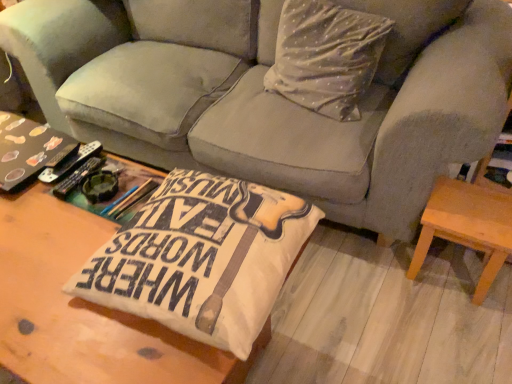
This screenshot has height=384, width=512. Find the location of `free point above light brown wooden stool at lower right, which appears as the first table when viewed from the back (from a real-world perspective)`. free point above light brown wooden stool at lower right, which appears as the first table when viewed from the back (from a real-world perspective) is located at coordinates (474, 203).